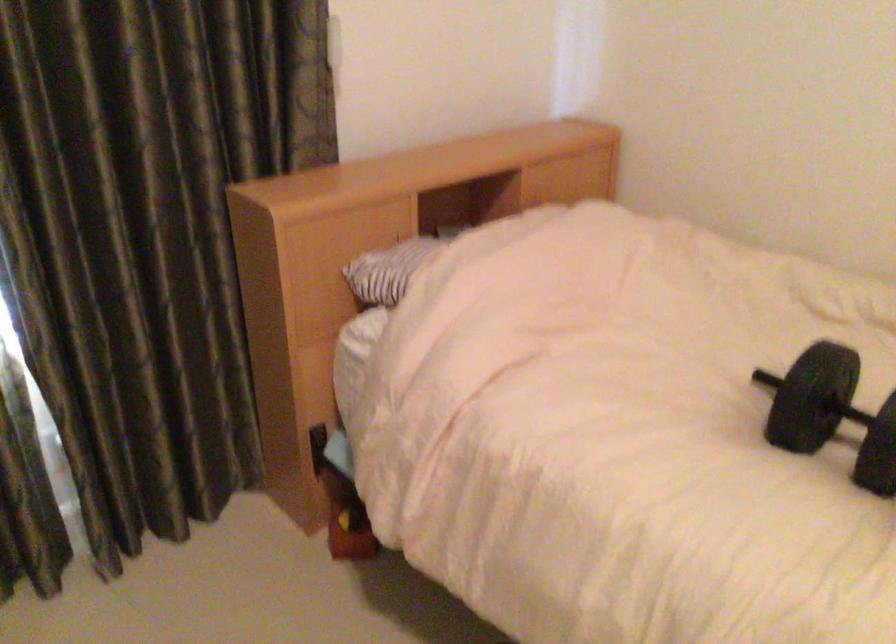
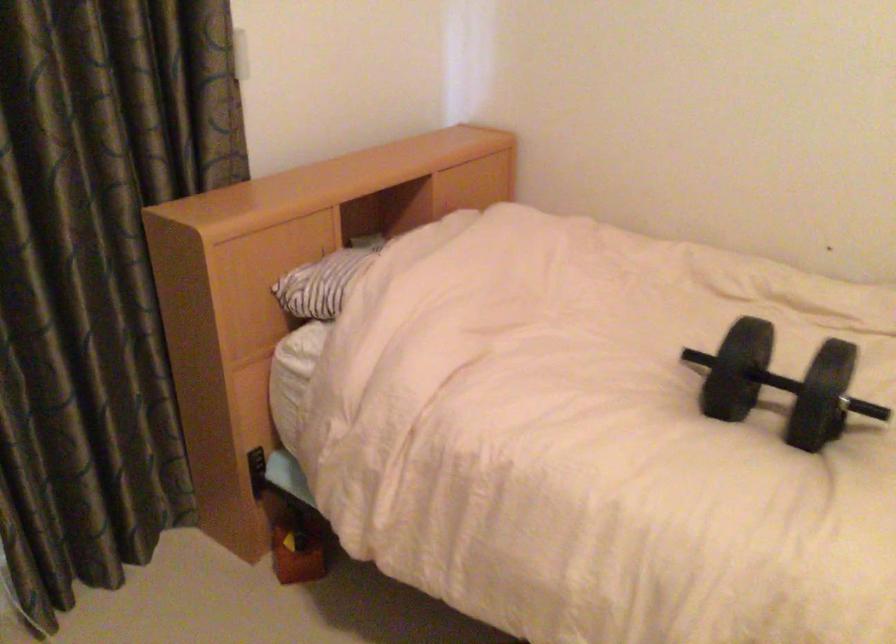
Question: The images are taken continuously from a first-person perspective. In which direction are you moving?

Choices:
 (A) Left
 (B) Right
 (C) Forward
 (D) Backward

Answer: (A)